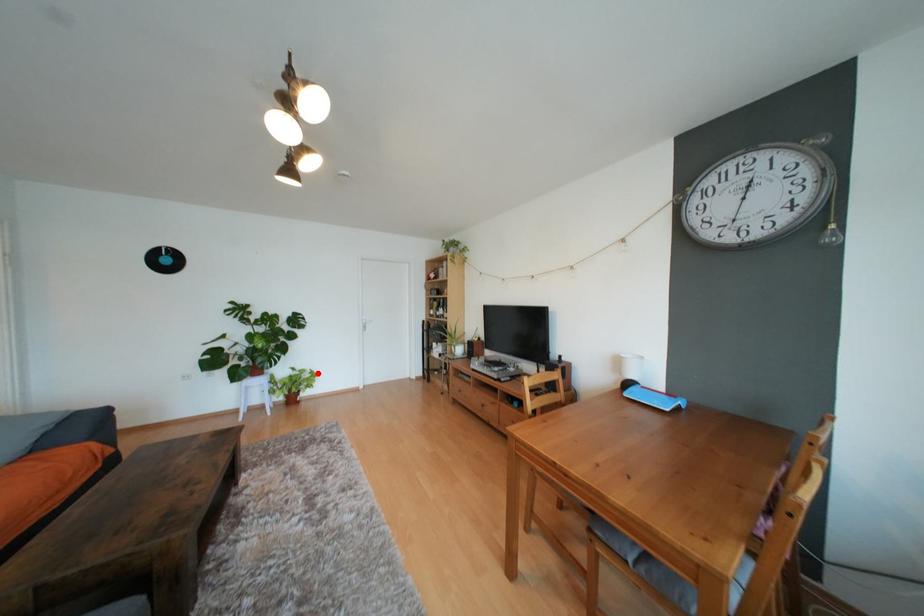
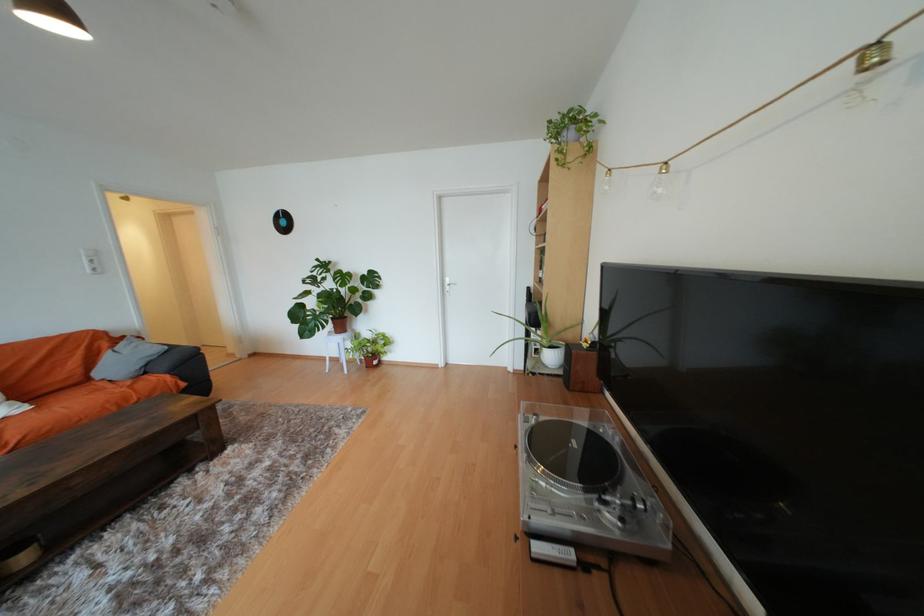
Where in the second image is the point corresponding to the highlighted location from the first image?

(391, 339)